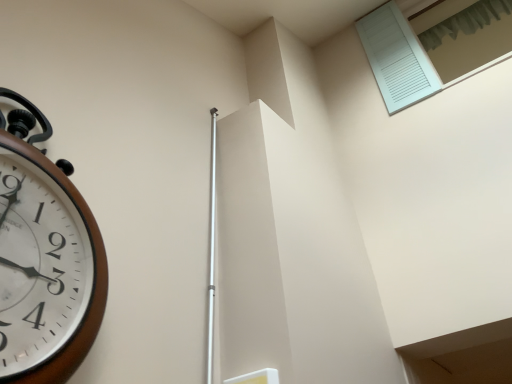
Identify the location of white textured shutter at upper right, which ranks as the second window in bottom-to-top order. (465, 35).

Find the location of a particular element. This screenshot has height=384, width=512. brown wooden wall clock at left is located at coordinates (44, 258).

Is point (484, 14) less distant than point (23, 292)?

No.

From the image's perspective, would you say white matte shutter at upper right, the 1th window in the bottom-to-top sequence, is shown under brown wooden wall clock at left?

No, from the image's perspective, white matte shutter at upper right, the 1th window in the bottom-to-top sequence, is not below brown wooden wall clock at left.

Is the depth of white matte shutter at upper right, the 1th window in the bottom-to-top sequence, greater than that of brown wooden wall clock at left?

Yes, white matte shutter at upper right, the 1th window in the bottom-to-top sequence, is further from the camera.

This screenshot has height=384, width=512. I want to click on the 1st window above the brown wooden wall clock at left (from the image's perspective), so click(x=432, y=48).

Who is more distant, brown wooden wall clock at left or white matte shutter at upper right, the 1th window in the bottom-to-top sequence?

white matte shutter at upper right, the 1th window in the bottom-to-top sequence, is further from the camera.

Is brown wooden wall clock at left oriented away from white matte shutter at upper right, the 2th window in the top-to-bottom sequence?

No.

How many degrees apart are the facing directions of brown wooden wall clock at left and white matte shutter at upper right, the 2th window in the top-to-bottom sequence?

The facing directions of brown wooden wall clock at left and white matte shutter at upper right, the 2th window in the top-to-bottom sequence, are 90.3 degrees apart.

Can you confirm if brown wooden wall clock at left is positioned to the right of white matte shutter at upper right, the 1th window in the bottom-to-top sequence?

In fact, brown wooden wall clock at left is to the left of white matte shutter at upper right, the 1th window in the bottom-to-top sequence.

Based on the photo, is brown wooden wall clock at left aimed at white textured shutter at upper right, the 1th window viewed from the top?

No, brown wooden wall clock at left does not turn towards white textured shutter at upper right, the 1th window viewed from the top.

Looking at this image, does brown wooden wall clock at left have a lesser height compared to white textured shutter at upper right, which ranks as the second window in bottom-to-top order?

In fact, brown wooden wall clock at left may be taller than white textured shutter at upper right, which ranks as the second window in bottom-to-top order.

Can you tell me how much brown wooden wall clock at left and white textured shutter at upper right, which ranks as the second window in bottom-to-top order, differ in facing direction?

They differ by 90.5 degrees in their facing directions.

From a real-world perspective, is brown wooden wall clock at left above or below white textured shutter at upper right, the 1th window viewed from the top?

brown wooden wall clock at left is below white textured shutter at upper right, the 1th window viewed from the top.

Where is `window that is the 2nd one when counting rightward from the brown wooden wall clock at left`? The width and height of the screenshot is (512, 384). window that is the 2nd one when counting rightward from the brown wooden wall clock at left is located at coordinates (465, 35).

From the image's perspective, is white textured shutter at upper right, the 1th window viewed from the top, positioned above or below brown wooden wall clock at left?

white textured shutter at upper right, the 1th window viewed from the top, is situated higher than brown wooden wall clock at left in the image.

Considering the sizes of white textured shutter at upper right, which ranks as the second window in bottom-to-top order, and brown wooden wall clock at left in the image, is white textured shutter at upper right, which ranks as the second window in bottom-to-top order, wider or thinner than brown wooden wall clock at left?

In the image, white textured shutter at upper right, which ranks as the second window in bottom-to-top order, appears to be wider than brown wooden wall clock at left.

Is brown wooden wall clock at left completely or partially inside white textured shutter at upper right, which ranks as the second window in bottom-to-top order?

That's incorrect, brown wooden wall clock at left is not inside white textured shutter at upper right, which ranks as the second window in bottom-to-top order.

Considering the sizes of objects white textured shutter at upper right, which ranks as the second window in bottom-to-top order, and white matte shutter at upper right, the 1th window in the bottom-to-top sequence, in the image provided, who is smaller, white textured shutter at upper right, which ranks as the second window in bottom-to-top order, or white matte shutter at upper right, the 1th window in the bottom-to-top sequence,?

white textured shutter at upper right, which ranks as the second window in bottom-to-top order.

Is white textured shutter at upper right, which ranks as the second window in bottom-to-top order, taller or shorter than white matte shutter at upper right, the 1th window in the bottom-to-top sequence?

Considering their sizes, white textured shutter at upper right, which ranks as the second window in bottom-to-top order, has less height than white matte shutter at upper right, the 1th window in the bottom-to-top sequence.

From the image's perspective, which one is positioned higher, white textured shutter at upper right, the 1th window viewed from the top, or white matte shutter at upper right, the 1th window in the bottom-to-top sequence?

From the image's view, white textured shutter at upper right, the 1th window viewed from the top, is above.

From the picture: Measure the distance from white textured shutter at upper right, the 1th window viewed from the top, to white matte shutter at upper right, the 2th window in the top-to-bottom sequence.

They are 4.17 inches apart.

Is white matte shutter at upper right, the 1th window in the bottom-to-top sequence, oriented away from white textured shutter at upper right, the 1th window viewed from the top?

Yes, white matte shutter at upper right, the 1th window in the bottom-to-top sequence,'s orientation is away from white textured shutter at upper right, the 1th window viewed from the top.

Considering the positions of objects white matte shutter at upper right, the 1th window in the bottom-to-top sequence, and white textured shutter at upper right, which ranks as the second window in bottom-to-top order, in the image provided, who is behind, white matte shutter at upper right, the 1th window in the bottom-to-top sequence, or white textured shutter at upper right, which ranks as the second window in bottom-to-top order,?

white textured shutter at upper right, which ranks as the second window in bottom-to-top order, is further from the camera.

Is point (437, 31) closer to camera compared to point (454, 19)?

No, (437, 31) is behind (454, 19).

From the image's perspective, relative to white textured shutter at upper right, which ranks as the second window in bottom-to-top order, is white matte shutter at upper right, the 2th window in the top-to-bottom sequence, above or below?

Based on their image positions, white matte shutter at upper right, the 2th window in the top-to-bottom sequence, is located beneath white textured shutter at upper right, which ranks as the second window in bottom-to-top order.

Locate an element on the screen. The width and height of the screenshot is (512, 384). wall clock below the white matte shutter at upper right, the 2th window in the top-to-bottom sequence (from a real-world perspective) is located at coordinates (44, 258).

There is a brown wooden wall clock at left. Where is `the 1st window above it (from a real-world perspective)`? the 1st window above it (from a real-world perspective) is located at coordinates (432, 48).

Considering their positions, is white textured shutter at upper right, the 1th window viewed from the top, positioned further to brown wooden wall clock at left than white matte shutter at upper right, the 1th window in the bottom-to-top sequence?

Among the two, white textured shutter at upper right, the 1th window viewed from the top, is located further to brown wooden wall clock at left.

Which object lies nearer to the anchor point white matte shutter at upper right, the 2th window in the top-to-bottom sequence, white textured shutter at upper right, which ranks as the second window in bottom-to-top order, or brown wooden wall clock at left?

white textured shutter at upper right, which ranks as the second window in bottom-to-top order, is closer to white matte shutter at upper right, the 2th window in the top-to-bottom sequence.

Looking at this image, looking at the image, which one is located further to brown wooden wall clock at left, white matte shutter at upper right, the 2th window in the top-to-bottom sequence, or white textured shutter at upper right, the 1th window viewed from the top?

white textured shutter at upper right, the 1th window viewed from the top, is positioned further to the anchor brown wooden wall clock at left.

Looking at the image, which one is located closer to white textured shutter at upper right, the 1th window viewed from the top, white matte shutter at upper right, the 1th window in the bottom-to-top sequence, or brown wooden wall clock at left?

Based on the image, white matte shutter at upper right, the 1th window in the bottom-to-top sequence, appears to be nearer to white textured shutter at upper right, the 1th window viewed from the top.

From the picture: When comparing their distances from white matte shutter at upper right, the 1th window in the bottom-to-top sequence, does brown wooden wall clock at left or white textured shutter at upper right, which ranks as the second window in bottom-to-top order, seem further?

brown wooden wall clock at left is positioned further to the anchor white matte shutter at upper right, the 1th window in the bottom-to-top sequence.

Consider the image. Looking at the image, which one is located closer to white textured shutter at upper right, the 1th window viewed from the top, brown wooden wall clock at left or white matte shutter at upper right, the 1th window in the bottom-to-top sequence?

white matte shutter at upper right, the 1th window in the bottom-to-top sequence, is closer to white textured shutter at upper right, the 1th window viewed from the top.

At what (x,y) coordinates should I click in order to perform the action: click on window positioned between brown wooden wall clock at left and white textured shutter at upper right, the 1th window viewed from the top, from near to far. Please return your answer as a coordinate pair (x, y). The height and width of the screenshot is (384, 512). Looking at the image, I should click on [432, 48].